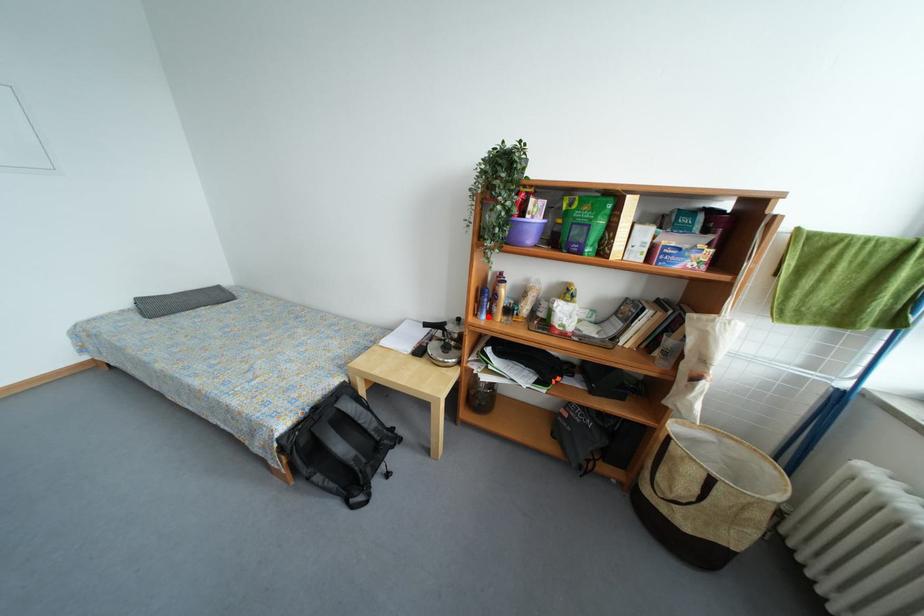
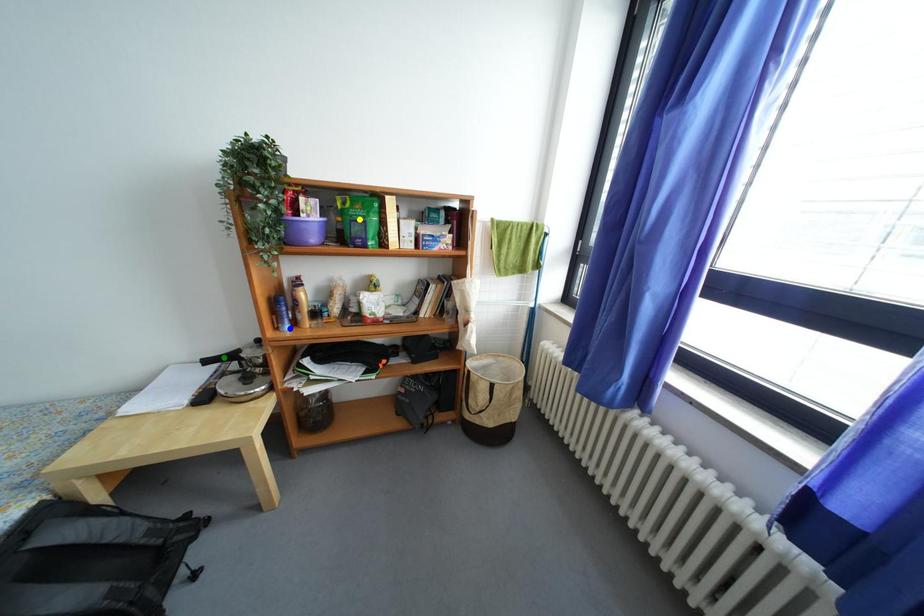
Question: I am providing you with two images of the same scene from different viewpoints. A red point is marked on the first image. You are given multiple points on the second image. Which point in image 2 is actually the same real-world point as the red point in image 1?

Choices:
 (A) yellow point
 (B) green point
 (C) blue point

Answer: (C)